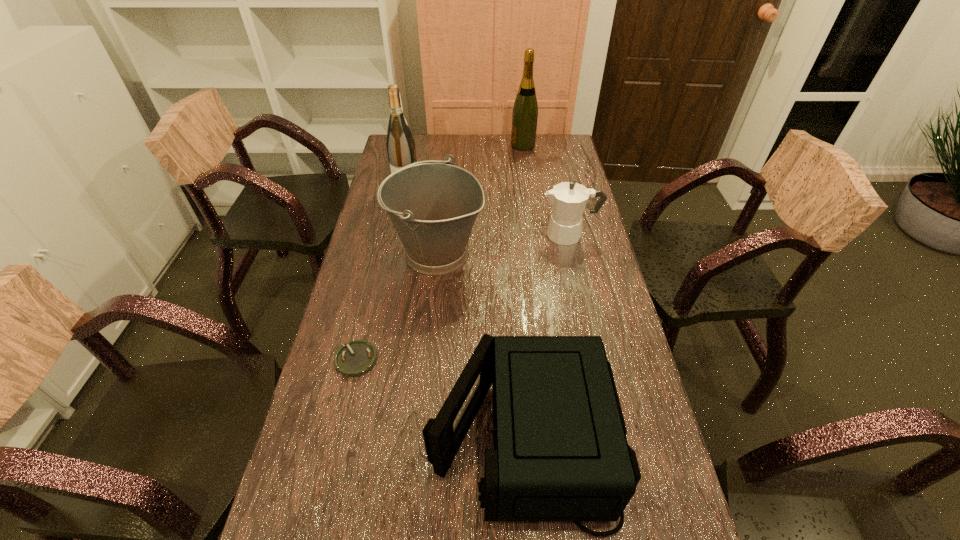
The height and width of the screenshot is (540, 960). Identify the location of blank area located on the front-facing side of the farthest object. (463, 145).

Identify the location of vacant space located 0.140m on the front of the nearer wine bottle. The height and width of the screenshot is (540, 960). (400, 217).

Where is `vacant space located 0.280m on the right of the fourth shortest object`? This screenshot has width=960, height=540. vacant space located 0.280m on the right of the fourth shortest object is located at coordinates (571, 253).

What are the coordinates of `free spot located 0.250m at the spout of the coffeepot` in the screenshot? It's located at (467, 234).

Identify the location of free spot located 0.320m at the spout of the coffeepot. The image size is (960, 540). (445, 234).

Where is `vacant space situated 0.130m at the spout of the coffeepot`? This screenshot has height=540, width=960. vacant space situated 0.130m at the spout of the coffeepot is located at coordinates (502, 234).

The width and height of the screenshot is (960, 540). What are the coordinates of `free space located 0.120m with the door open on the microwave oven` in the screenshot? It's located at (378, 434).

This screenshot has width=960, height=540. What are the coordinates of `vacant region located 0.250m with the door open on the microwave oven` in the screenshot? It's located at (322, 434).

You are a GUI agent. You are given a task and a screenshot of the screen. Output one action in this format:
    pyautogui.click(x=<x>, y=<y>)
    Task: Click on the vacant space situated with the door open on the microwave oven
    Image resolution: width=960 pixels, height=540 pixels.
    Given the screenshot: What is the action you would take?
    pyautogui.click(x=352, y=434)

Locate an element on the screen. vacant space situated on the front of the shortest object is located at coordinates pyautogui.click(x=325, y=490).